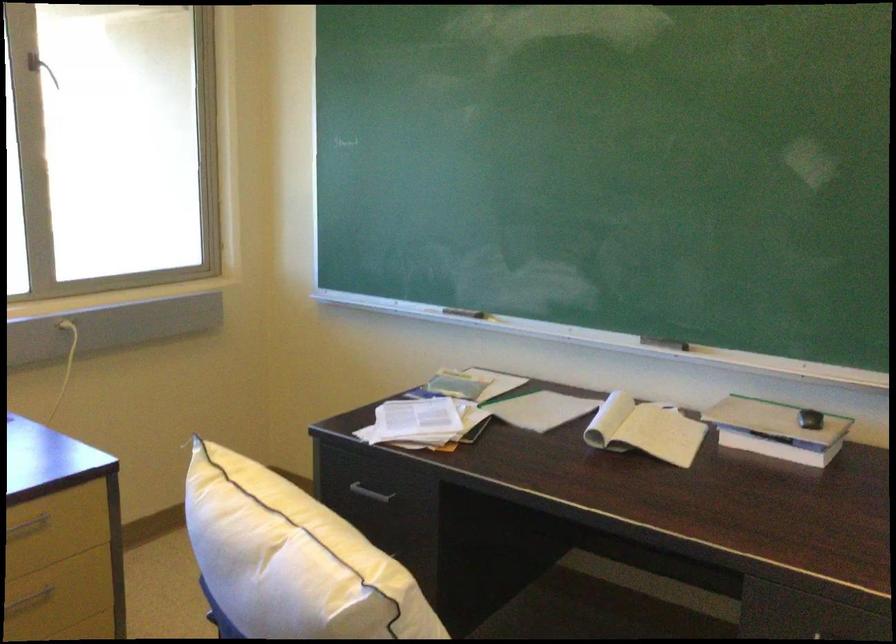
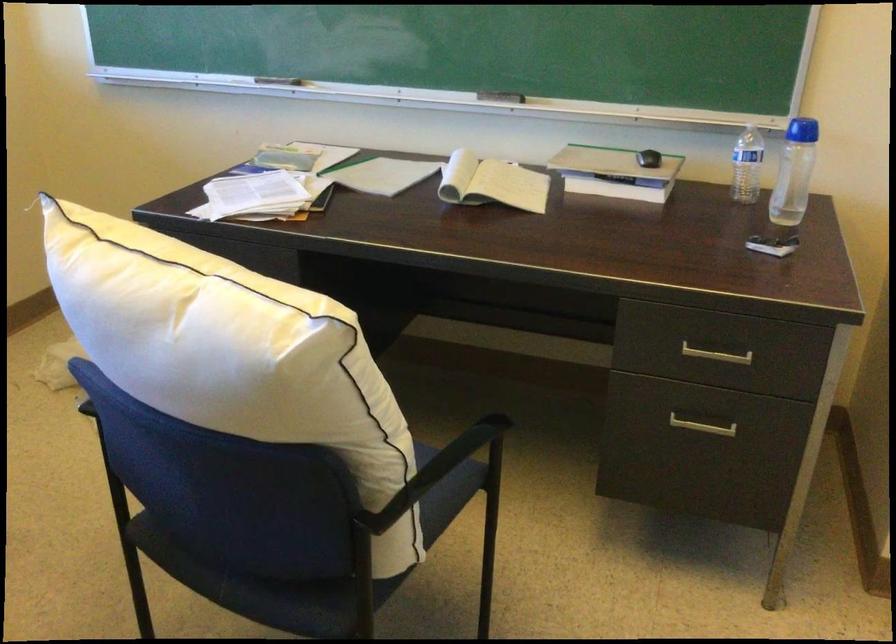
Question: I am providing you with two images of the same scene from different viewpoints. After the viewpoint changes to image2, which objects are now occluded?

Choices:
 (A) open spiral notebook
 (B) metal drawer handle
 (C) white pillow
 (D) none of these

Answer: (D)